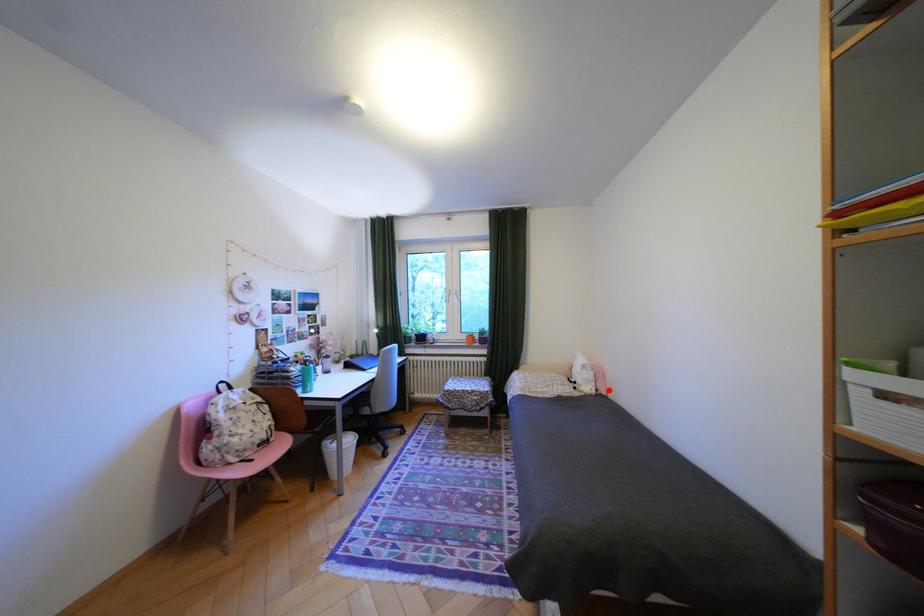
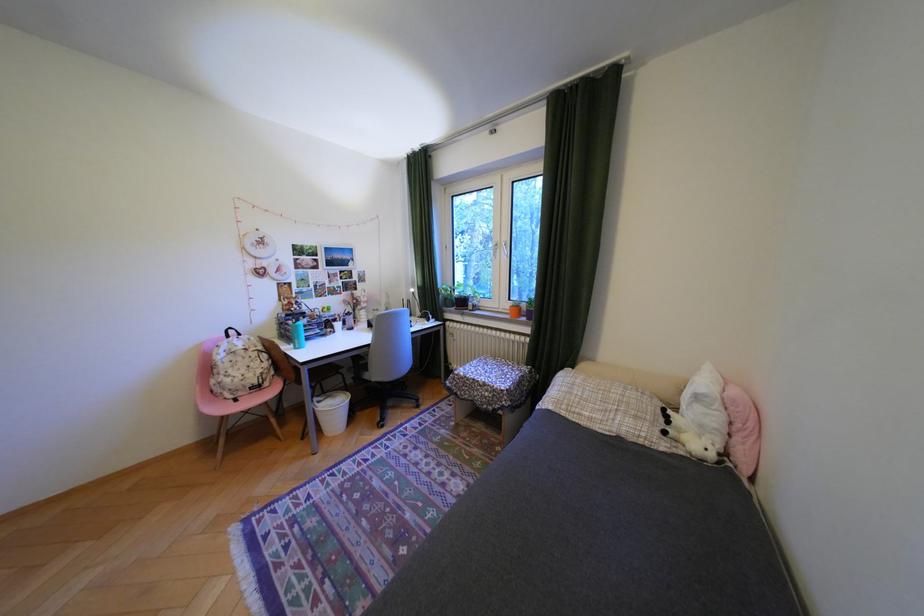
Question: I am providing you with two images of the same scene from different viewpoints. A red point is shown in image1. For the corresponding object point in image2, is it positioned nearer or farther from the camera?

Choices:
 (A) Nearer
 (B) Farther

Answer: (A)